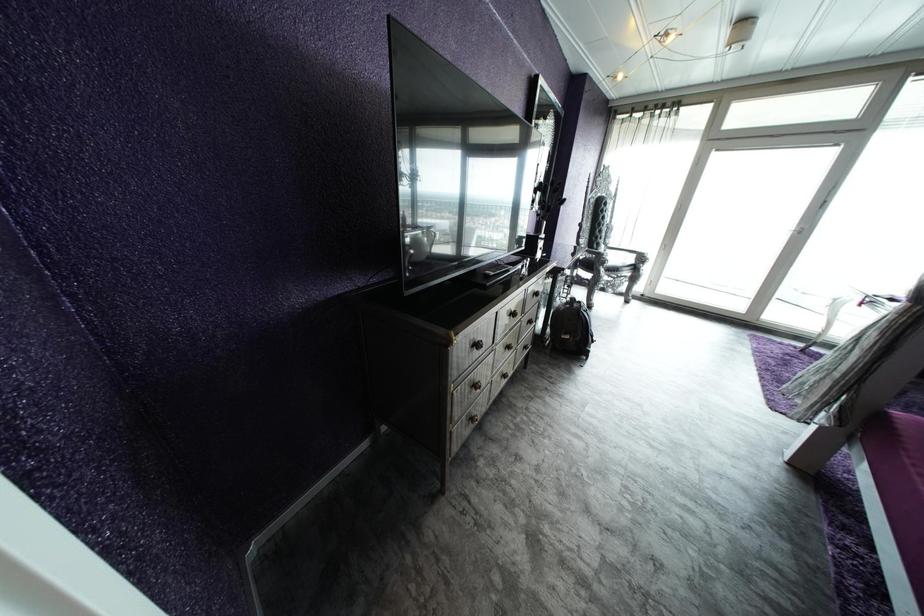
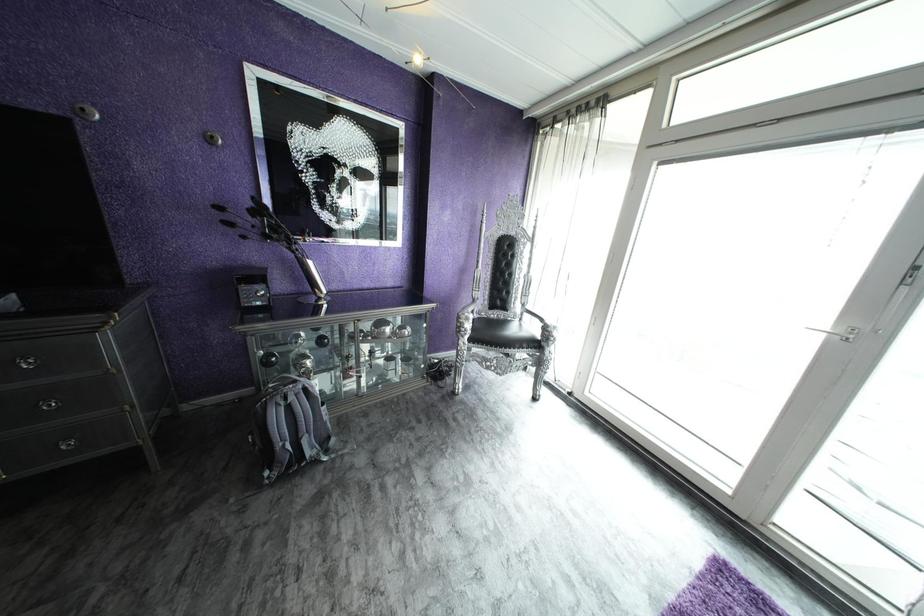
The images are taken continuously from a first-person perspective. In which direction are you moving?

The cameraman moved toward right, forward.